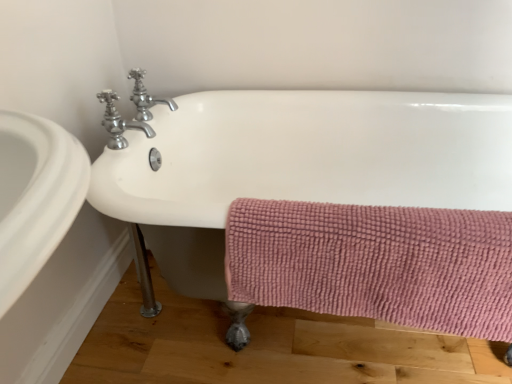
Question: From a real-world perspective, relative to white ceramic bathtub at center, is pink textured towel at lower right vertically above or below?

Choices:
 (A) below
 (B) above

Answer: (B)

Question: From the image's perspective, is pink textured towel at lower right positioned above or below white ceramic bathtub at center?

Choices:
 (A) below
 (B) above

Answer: (A)

Question: Which is farther from the polished chrome faucet at upper left, the 1th tap when ordered from front to back?

Choices:
 (A) polished chrome faucet at upper left, positioned as the 1th tap in back-to-front order
 (B) pink textured towel at lower right
 (C) white ceramic bathtub at center

Answer: (B)

Question: Based on their relative distances, which object is farther from the pink textured towel at lower right?

Choices:
 (A) polished chrome faucet at upper left, which is counted as the 2th tap, starting from the back
 (B) polished chrome faucet at upper left, positioned as the 1th tap in back-to-front order
 (C) white ceramic bathtub at center

Answer: (B)